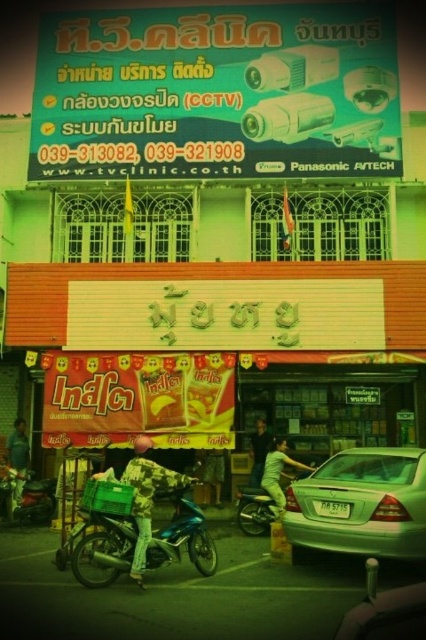
Question: Is silver metallic sedan at lower right to the right of metallic silver motorcycle at center from the viewer's perspective?

Choices:
 (A) yes
 (B) no

Answer: (A)

Question: Among these points, which one is nearest to the camera?

Choices:
 (A) (321, 516)
 (B) (20, 474)
 (C) (109, 545)

Answer: (C)

Question: Can you confirm if teal metallic motorcycle at center is positioned below metallic silver motorcycle at center?

Choices:
 (A) no
 (B) yes

Answer: (B)

Question: Which object is closer to the camera taking this photo?

Choices:
 (A) metallic silver motorcycle at center
 (B) silver metallic sedan at lower right
 (C) camouflage fabric jacket at center

Answer: (B)

Question: Can you confirm if camouflage fabric jacket at center is bigger than green fabric shirt at center?

Choices:
 (A) yes
 (B) no

Answer: (A)

Question: Which of the following is the closest to the observer?

Choices:
 (A) (74, 550)
 (B) (282, 467)
 (C) (135, 554)
 (D) (25, 432)

Answer: (A)